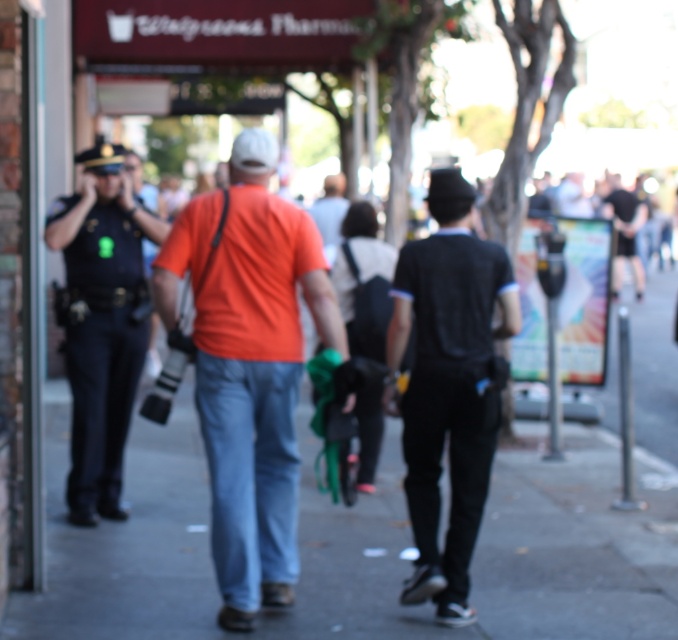
You are a fashion designer analyzing the clothing items in the scene. Which clothing item, the orange cotton shirt at center or the dark blue jeans at center, appears narrower?

The orange cotton shirt at center appears narrower than the dark blue jeans at center as it has a lesser width compared to the dark blue jeans at center.